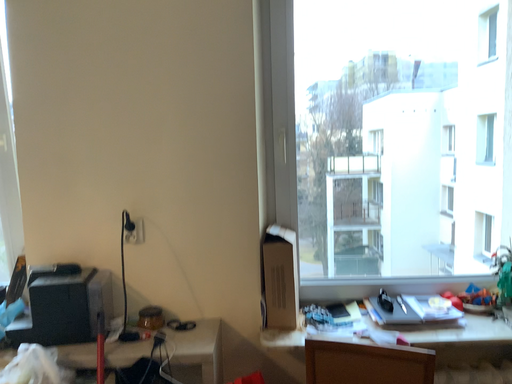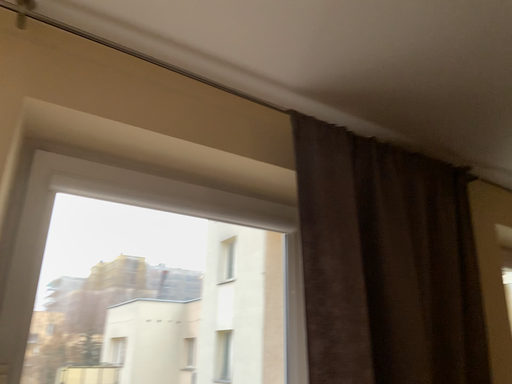
Question: How did the camera likely rotate when shooting the video?

Choices:
 (A) rotated right
 (B) rotated left

Answer: (A)